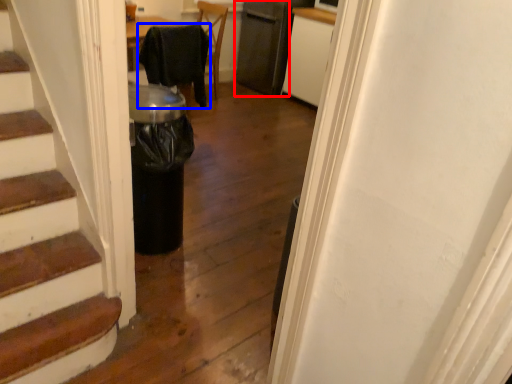
Question: Which point is further to the camera, appliance (highlighted by a red box) or chair (highlighted by a blue box)?

Choices:
 (A) appliance
 (B) chair

Answer: (A)